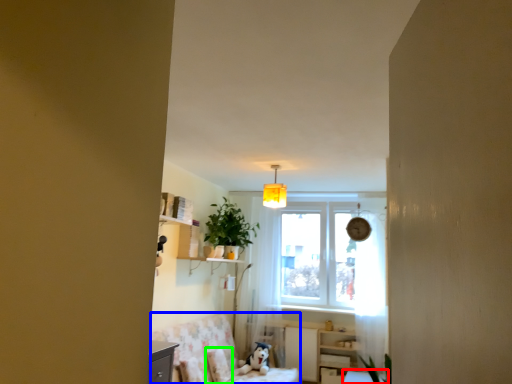
Question: Based on their relative distances, which object is nearer to table (highlighted by a red box)? Choose from swivel chair (highlighted by a blue box) and pillow (highlighted by a green box).

Choices:
 (A) swivel chair
 (B) pillow

Answer: (A)